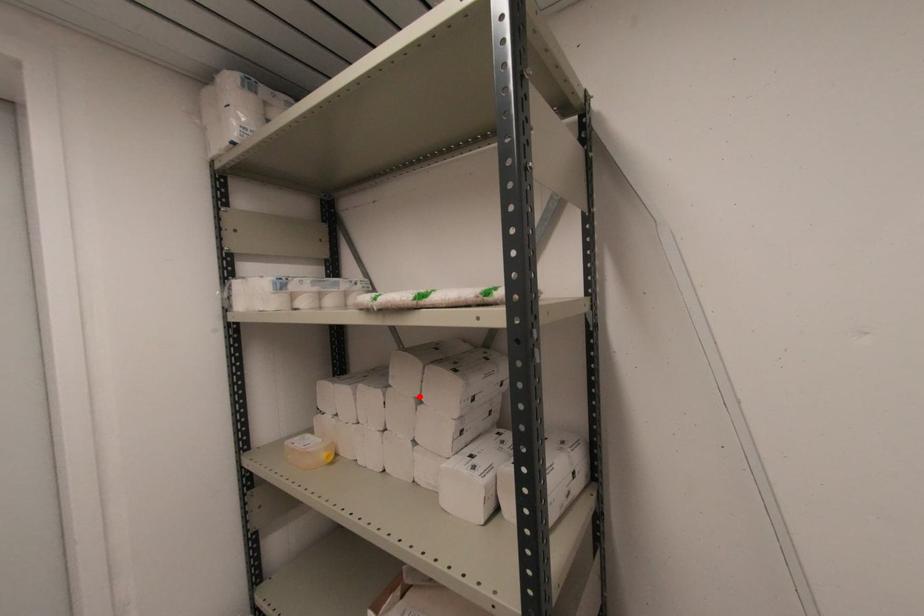
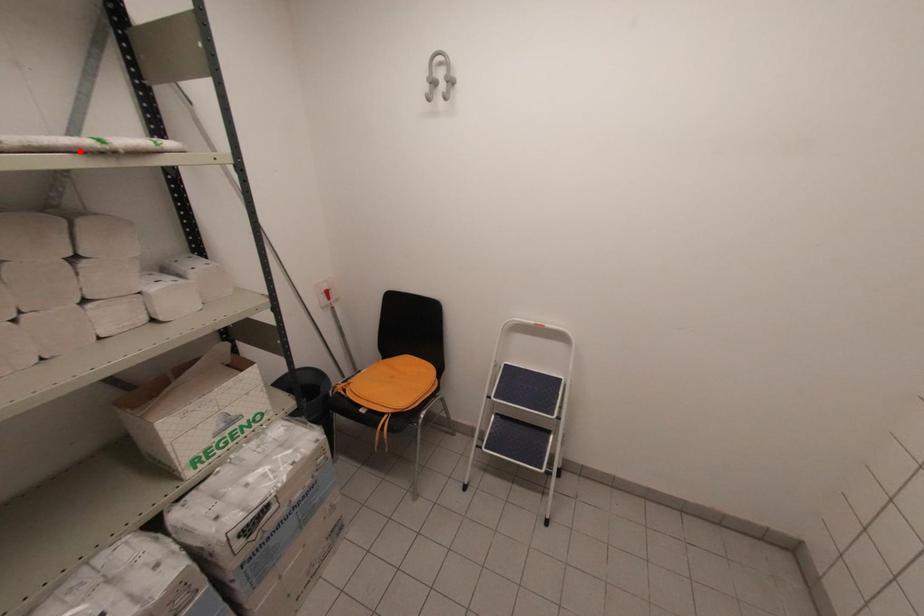
I am providing you with two images of the same scene from different viewpoints. A red point is marked on the first image and another point is marked on the second image. Is the marked point in image1 the same physical position as the marked point in image2?

No